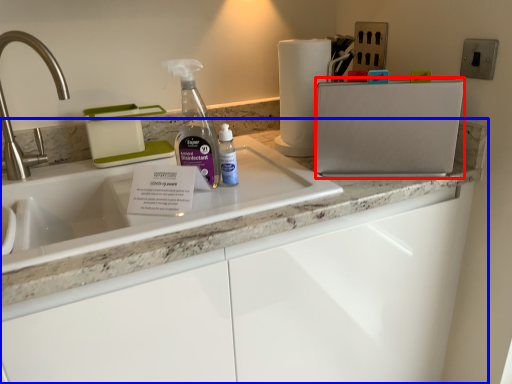
Question: Which object is further to the camera taking this photo, appliance (highlighted by a red box) or countertop (highlighted by a blue box)?

Choices:
 (A) appliance
 (B) countertop

Answer: (A)